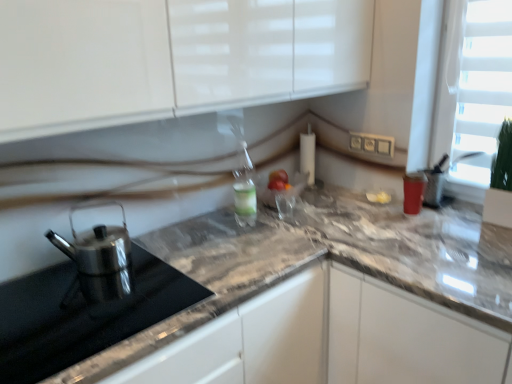
Where is `vacant space situated above marble countertop at right (from a real-world perspective)`? vacant space situated above marble countertop at right (from a real-world perspective) is located at coordinates (431, 245).